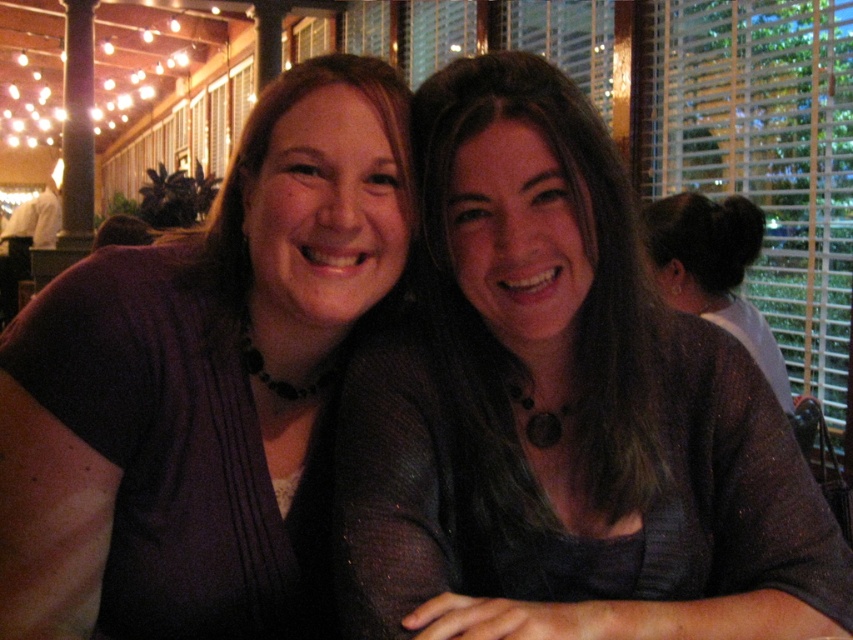
Is matte gray sweater at center to the left of purple fabric shirt at center from the viewer's perspective?

No, matte gray sweater at center is not to the left of purple fabric shirt at center.

Is point (512, 518) behind point (47, 579)?

Yes, it is.

Which is behind, point (491, 109) or point (289, 332)?

The point (289, 332) is behind.

This screenshot has width=853, height=640. What are the coordinates of `matte gray sweater at center` in the screenshot? It's located at (561, 412).